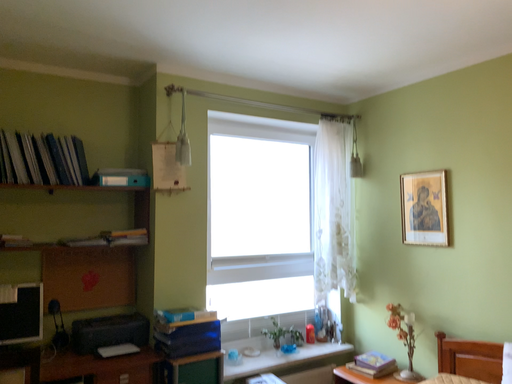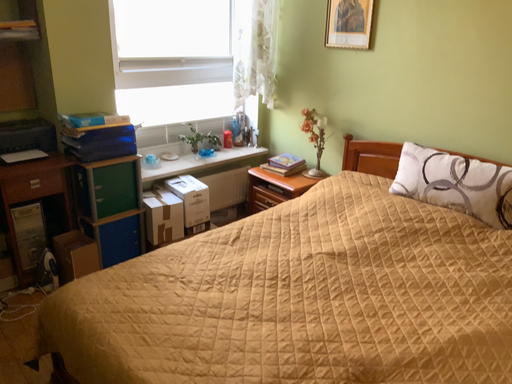
Question: How did the camera likely rotate when shooting the video?

Choices:
 (A) rotated downward
 (B) rotated upward

Answer: (A)